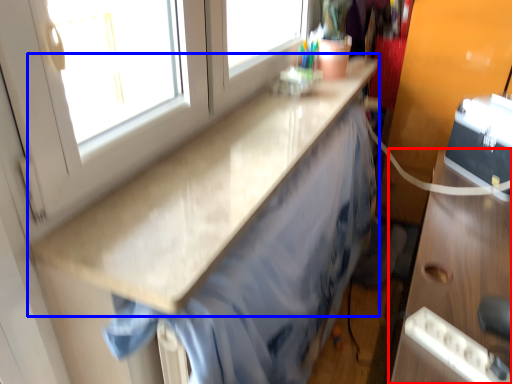
Question: Which point is closer to the camera, cabinetry (highlighted by a red box) or countertop (highlighted by a blue box)?

Choices:
 (A) cabinetry
 (B) countertop

Answer: (A)